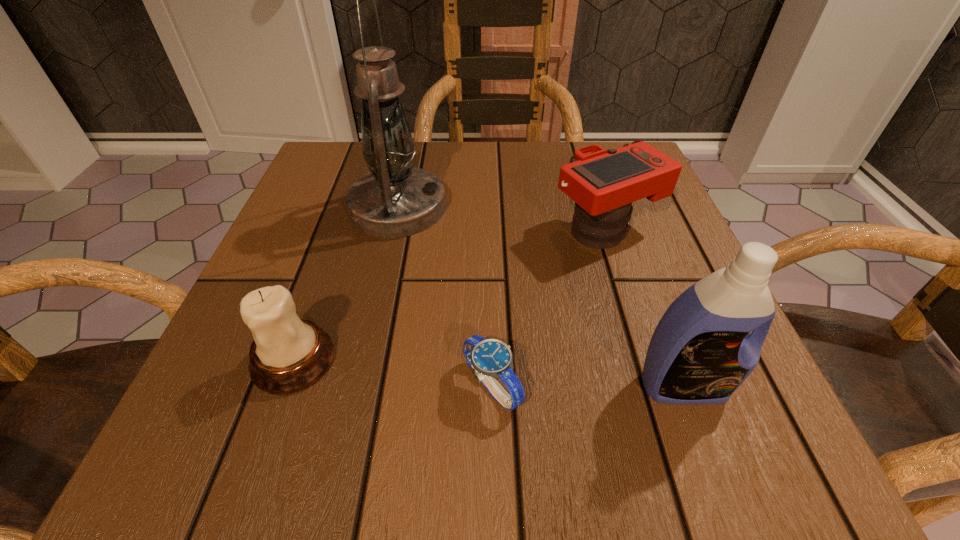
In the image, there is a desktop. What are the coordinates of `vacant space at the right edge` in the screenshot? It's located at tap(684, 286).

Identify the location of free spot at the near left corner of the desktop. (189, 443).

Image resolution: width=960 pixels, height=540 pixels. What are the coordinates of `free spot at the far right corner of the desktop` in the screenshot? It's located at (573, 149).

The height and width of the screenshot is (540, 960). Find the location of `vacant area that lies between the watch and the tallest object`. vacant area that lies between the watch and the tallest object is located at coordinates (444, 296).

This screenshot has width=960, height=540. I want to click on empty space that is in between the candle holder and the tallest object, so click(346, 284).

What are the coordinates of `vacant region between the third object from left to right and the oil lamp` in the screenshot? It's located at (444, 296).

Where is `free area in between the shortest object and the fourth shortest object`? The image size is (960, 540). free area in between the shortest object and the fourth shortest object is located at coordinates (588, 386).

This screenshot has height=540, width=960. In order to click on vacant space that is in between the camera and the candle holder in this screenshot , I will do `click(449, 295)`.

You are a GUI agent. You are given a task and a screenshot of the screen. Output one action in this format:
    pyautogui.click(x=<x>, y=<y>)
    Task: Click on the vacant space that is in between the candle holder and the shortest object
    This screenshot has height=540, width=960.
    Given the screenshot: What is the action you would take?
    pyautogui.click(x=393, y=373)

Identify the location of free space between the detergent and the tallest object. This screenshot has height=540, width=960. (540, 296).